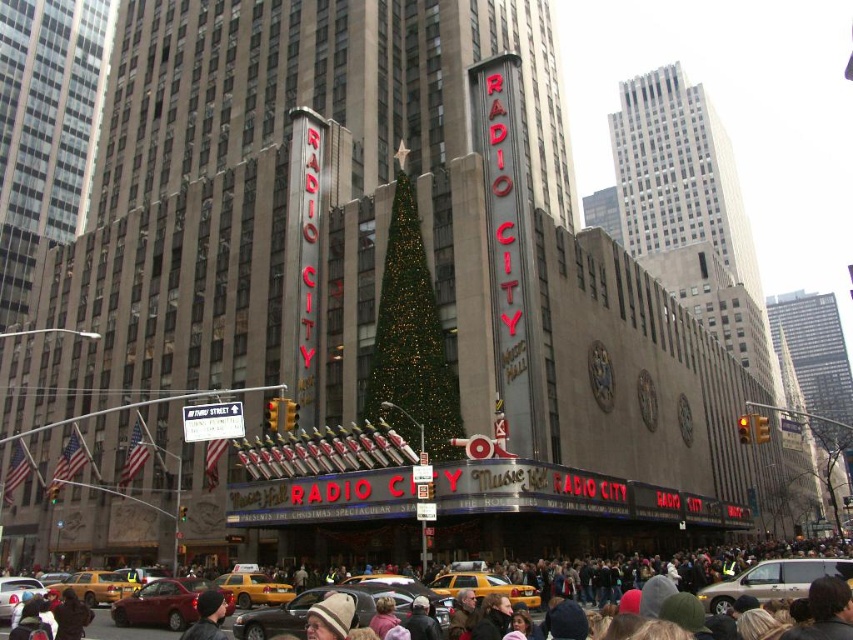
Can you confirm if khaki fabric hat at center is positioned to the left of dark gray knit cap at lower left?

No, khaki fabric hat at center is not to the left of dark gray knit cap at lower left.

The width and height of the screenshot is (853, 640). Identify the location of khaki fabric hat at center. (329, 618).

Does point (326, 636) come farther from viewer compared to point (207, 604)?

No.

The width and height of the screenshot is (853, 640). I want to click on khaki fabric hat at center, so click(329, 618).

Is the position of yellow rubber taxi at lower center less distant than that of khaki fabric hat at center?

No.

Who is lower down, yellow rubber taxi at lower center or khaki fabric hat at center?

Positioned lower is yellow rubber taxi at lower center.

The image size is (853, 640). What are the coordinates of `yellow rubber taxi at lower center` in the screenshot? It's located at (254, 588).

Which of these two, dark gray knit cap at lower left or dark brown fur coat at lower left, stands shorter?

dark brown fur coat at lower left

Can you confirm if dark gray knit cap at lower left is bigger than dark brown fur coat at lower left?

Actually, dark gray knit cap at lower left might be smaller than dark brown fur coat at lower left.

Who is more forward, (218, 611) or (80, 605)?

Point (218, 611)

Find the location of a particular element. This screenshot has height=640, width=853. dark gray knit cap at lower left is located at coordinates (207, 616).